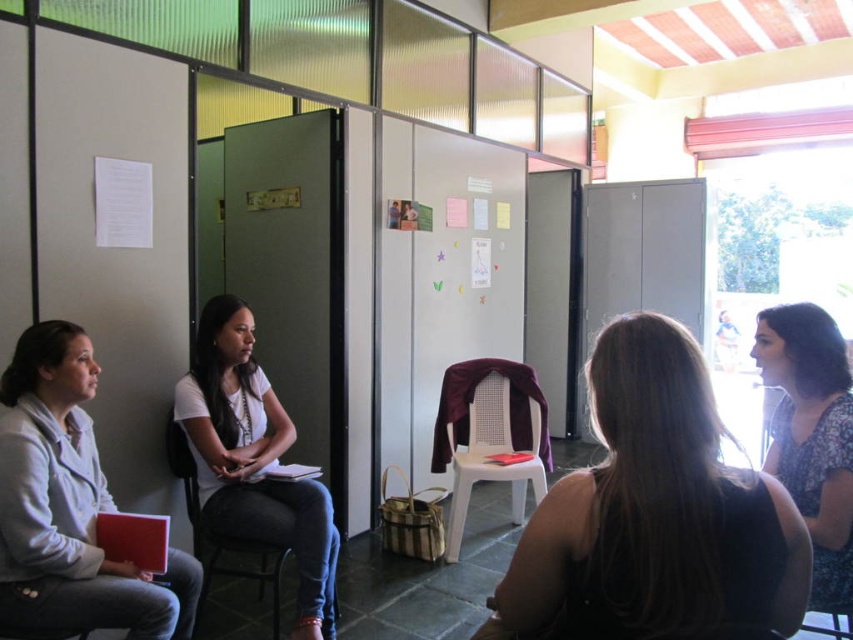
Question: Which of the following is the farthest from the observer?

Choices:
 (A) white plastic chair at center
 (B) floral dress at right
 (C) dark brown hair at center
 (D) light gray fabric jacket at left

Answer: (A)

Question: Which point is farther from the camera taking this photo?

Choices:
 (A) (239, 570)
 (B) (460, 419)
 (C) (851, 380)

Answer: (B)

Question: Does light gray fabric jacket at left lie in front of floral dress at right?

Choices:
 (A) yes
 (B) no

Answer: (B)

Question: Is white matte shirt at center to the right of floral dress at right from the viewer's perspective?

Choices:
 (A) yes
 (B) no

Answer: (B)

Question: Which of the following is the closest to the observer?

Choices:
 (A) white matte shirt at center
 (B) dark brown hair at center
 (C) white plastic chair at center

Answer: (B)

Question: Can you confirm if white plastic chair at center is positioned below black plastic chair at center?

Choices:
 (A) no
 (B) yes

Answer: (A)